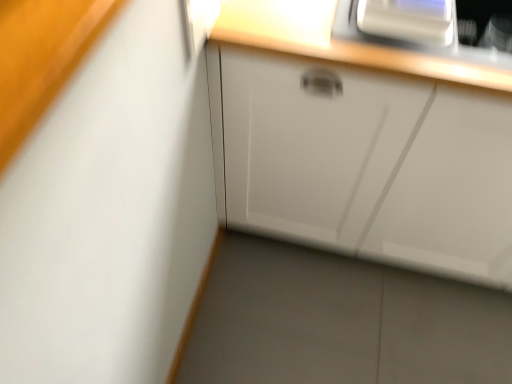
The height and width of the screenshot is (384, 512). Describe the element at coordinates (364, 163) in the screenshot. I see `white glossy cabinet at center` at that location.

Where is `white glossy cabinet at center`? Image resolution: width=512 pixels, height=384 pixels. white glossy cabinet at center is located at coordinates 364,163.

Find the location of a particular element. Image resolution: width=512 pixels, height=384 pixels. white glossy cabinet at center is located at coordinates (364, 163).